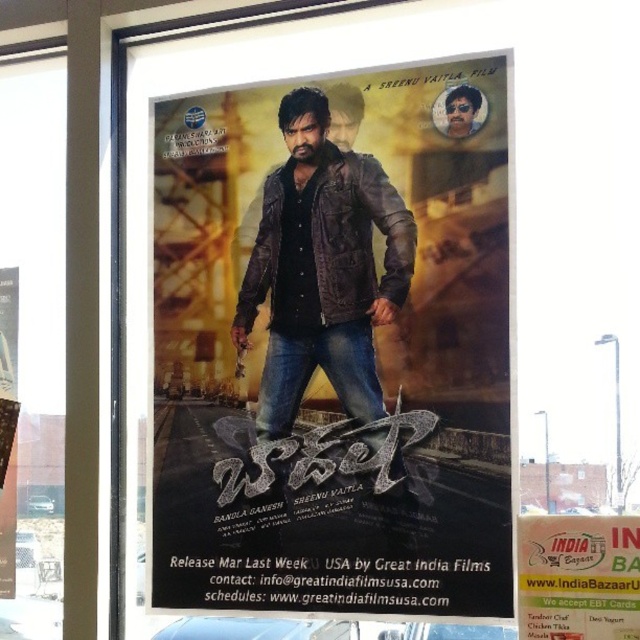
Question: Which of the following is the closest to the observer?

Choices:
 (A) (326, 177)
 (B) (589, 552)

Answer: (B)

Question: Is leather jacket at center positioned behind brown leather jacket at center?

Choices:
 (A) yes
 (B) no

Answer: (B)

Question: Which of the following is the closest to the observer?

Choices:
 (A) white paper sign at lower right
 (B) leather jacket at center
 (C) brown leather jacket at center

Answer: (A)

Question: Observing the image, what is the correct spatial positioning of leather jacket at center in reference to brown leather jacket at center?

Choices:
 (A) above
 (B) below

Answer: (B)

Question: Does brown leather jacket at center have a larger size compared to white paper sign at lower right?

Choices:
 (A) no
 (B) yes

Answer: (B)

Question: Among these objects, which one is farthest from the camera?

Choices:
 (A) white paper sign at lower right
 (B) brown leather jacket at center
 (C) leather jacket at center

Answer: (B)